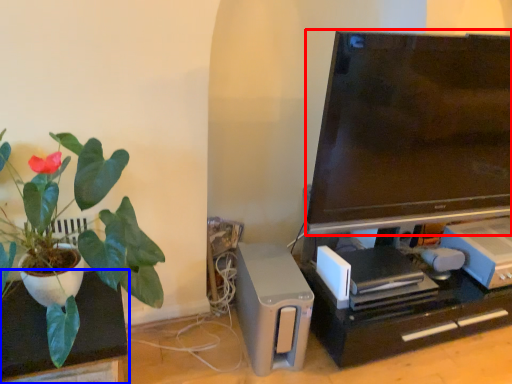
Question: Which point is closer to the camera, television (highlighted by a red box) or furniture (highlighted by a blue box)?

Choices:
 (A) television
 (B) furniture

Answer: (B)